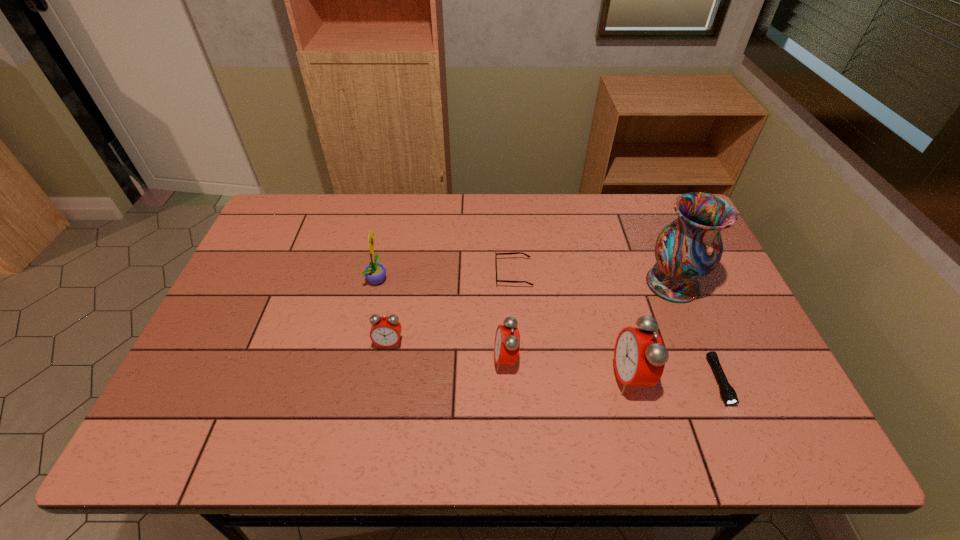
Identify the location of vacant space located 0.060m on the front-facing side of the leftmost alarm clock. (384, 371).

Image resolution: width=960 pixels, height=540 pixels. What are the coordinates of `vacant space located 0.380m on the front-facing side of the second shortest alarm clock` in the screenshot? It's located at (343, 360).

I want to click on vacant area situated 0.100m on the front-facing side of the second shortest alarm clock, so click(x=454, y=360).

Identify the location of vacant region located 0.280m on the front-facing side of the second shortest alarm clock. (382, 360).

The width and height of the screenshot is (960, 540). In order to click on vacant space located on the front-facing side of the rightmost alarm clock in this screenshot , I will do `click(527, 377)`.

Locate an element on the screen. The image size is (960, 540). vacant area situated on the front-facing side of the rightmost alarm clock is located at coordinates (592, 377).

This screenshot has width=960, height=540. What are the coordinates of `vacant space located on the front-facing side of the rightmost alarm clock` in the screenshot? It's located at (551, 377).

Identify the location of vacant space located on the left of the vase. The width and height of the screenshot is (960, 540). (607, 284).

At what (x,y) coordinates should I click in order to perform the action: click on vacant point located 0.170m on the front-facing side of the sunglasses. Please return your answer as a coordinate pair (x, y). The height and width of the screenshot is (540, 960). Looking at the image, I should click on (439, 273).

Where is `free space located 0.280m on the front-facing side of the sunglasses`? This screenshot has width=960, height=540. free space located 0.280m on the front-facing side of the sunglasses is located at coordinates (402, 273).